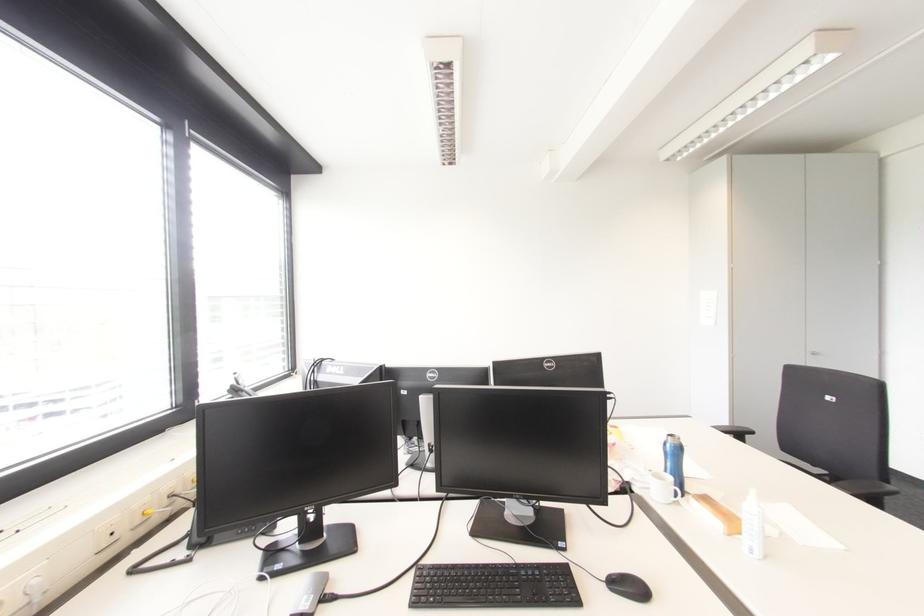
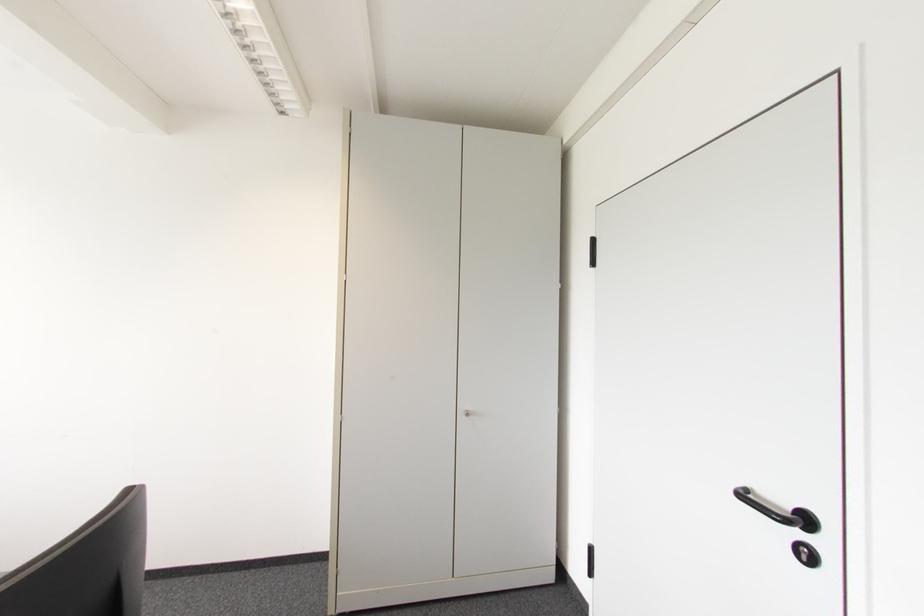
In a continuous first-person perspective shot, in which direction is the camera moving?

The cameraman walked toward right, forward.